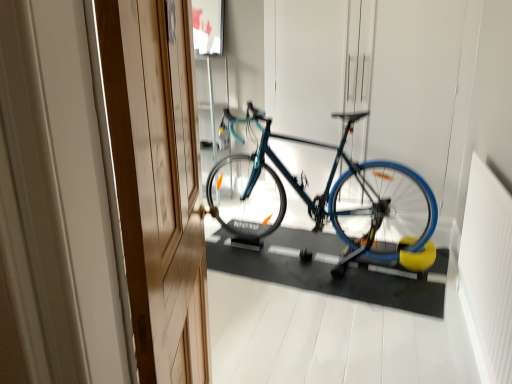
Describe the element at coordinates (157, 182) in the screenshot. The image size is (512, 384). I see `wooden door at left` at that location.

Find the location of a particular element. wooden door at left is located at coordinates (157, 182).

This screenshot has width=512, height=384. Identify the location of shiny blue bicycle at center. (326, 197).

This screenshot has width=512, height=384. What do you see at coordinates (326, 197) in the screenshot?
I see `shiny blue bicycle at center` at bounding box center [326, 197].

From the picture: What is the approximate width of shiny blue bicycle at center?

shiny blue bicycle at center is 5.75 feet in width.

Locate an element on the screen. Image resolution: width=512 pixels, height=384 pixels. wooden door at left is located at coordinates (157, 182).

Considering the relative positions of wooden door at left and shiny blue bicycle at center in the image provided, is wooden door at left to the left of shiny blue bicycle at center from the viewer's perspective?

Indeed, wooden door at left is positioned on the left side of shiny blue bicycle at center.

Relative to shiny blue bicycle at center, is wooden door at left in front or behind?

Visually, wooden door at left is located in front of shiny blue bicycle at center.

Is point (196, 150) farther from viewer compared to point (278, 180)?

No, (196, 150) is in front of (278, 180).

From the picture: From the image's perspective, who appears lower, wooden door at left or shiny blue bicycle at center?

wooden door at left is shown below in the image.

From a real-world perspective, is wooden door at left beneath shiny blue bicycle at center?

Actually, wooden door at left is physically above shiny blue bicycle at center in the real world.

Does wooden door at left have a greater width compared to shiny blue bicycle at center?

Incorrect, the width of wooden door at left does not surpass that of shiny blue bicycle at center.

Which of these two, wooden door at left or shiny blue bicycle at center, stands shorter?

shiny blue bicycle at center is shorter.

Who is bigger, wooden door at left or shiny blue bicycle at center?

shiny blue bicycle at center.

Which is correct: wooden door at left is inside shiny blue bicycle at center, or outside of it?

wooden door at left is not inside shiny blue bicycle at center, it's outside.

Is wooden door at left far from shiny blue bicycle at center?

wooden door at left is positioned a significant distance from shiny blue bicycle at center.

Is wooden door at left looking in the opposite direction of shiny blue bicycle at center?

wooden door at left is not turned away from shiny blue bicycle at center.

Locate an element on the screen. bicycle below the wooden door at left (from a real-world perspective) is located at coordinates (326, 197).

Based on the photo, between shiny blue bicycle at center and wooden door at left, which one appears on the left side from the viewer's perspective?

wooden door at left is more to the left.

Considering the positions of objects shiny blue bicycle at center and wooden door at left in the image provided, who is behind, shiny blue bicycle at center or wooden door at left?

shiny blue bicycle at center is more distant.

Which is in front, point (431, 261) or point (180, 377)?

The point (180, 377) is closer to the camera.

From the image's perspective, is shiny blue bicycle at center located above or below wooden door at left?

From the image's perspective, shiny blue bicycle at center appears above wooden door at left.

From a real-world perspective, between shiny blue bicycle at center and wooden door at left, who is vertically lower?

shiny blue bicycle at center, from a real-world perspective.

Considering the relative sizes of shiny blue bicycle at center and wooden door at left in the image provided, is shiny blue bicycle at center thinner than wooden door at left?

In fact, shiny blue bicycle at center might be wider than wooden door at left.

Between shiny blue bicycle at center and wooden door at left, which one has more height?

With more height is wooden door at left.

Considering the relative sizes of shiny blue bicycle at center and wooden door at left in the image provided, is shiny blue bicycle at center smaller than wooden door at left?

No.

Is shiny blue bicycle at center positioned beyond the bounds of wooden door at left?

shiny blue bicycle at center lies outside wooden door at left's area.

Does shiny blue bicycle at center touch wooden door at left?

No, shiny blue bicycle at center is not touching wooden door at left.

Is shiny blue bicycle at center aimed at wooden door at left?

No, shiny blue bicycle at center is not oriented towards wooden door at left.

Locate an element on the screen. bicycle below the wooden door at left (from a real-world perspective) is located at coordinates (326, 197).

Locate an element on the screen. The image size is (512, 384). door on the left of shiny blue bicycle at center is located at coordinates (157, 182).

There is a shiny blue bicycle at center. Find the location of `door above it (from a real-world perspective)`. door above it (from a real-world perspective) is located at coordinates (157, 182).